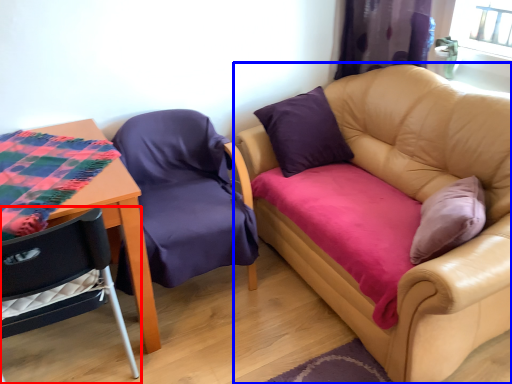
Question: Which object is closer to the camera taking this photo, chair (highlighted by a red box) or studio couch (highlighted by a blue box)?

Choices:
 (A) chair
 (B) studio couch

Answer: (B)